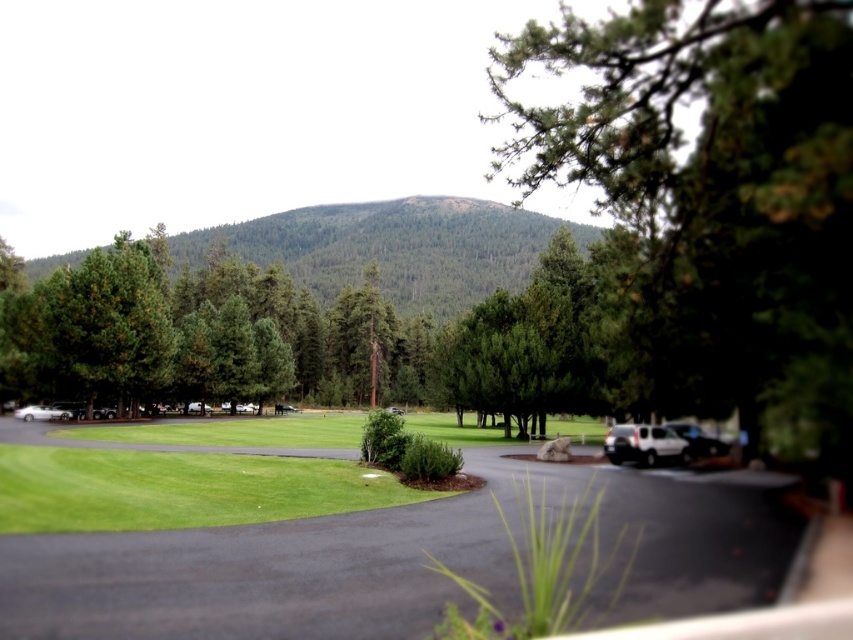
You are planning a picnic and want to set up your blanket on the green grass at center. However, you notice the green forested mountain at center in the background. Is the mountain above or below the grass in the image?

The green grass at center is located below the green forested mountain at center, so the mountain is above the grass in the image.

You are a delivery person needing to park your vehicle in this area. You have a large delivery truck that requires more space than a standard car. Looking at the white matte suv at lower right and the metallic silver car at left, which vehicle would be the better reference for ensuring your truck has enough space?

The white matte suv at lower right has a larger size compared to the metallic silver car at left, so it would be the better reference for ensuring your truck has enough space.

You are planning a picnic and need to choose a spot that can accommodate a large blanket. Based on the image, which area between the green grass at center and the green forested mountain at center would you recommend?

The green grass at center has a smaller size compared to the green forested mountain at center, so the green forested mountain at center is larger and more suitable for placing a large blanket.